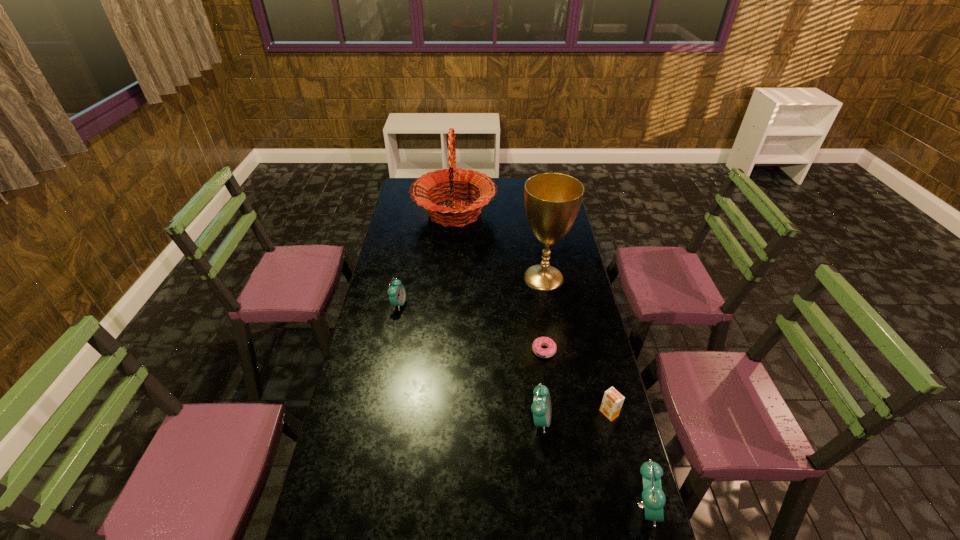
Image resolution: width=960 pixels, height=540 pixels. What are the coordinates of `orange juice` in the screenshot? It's located at (612, 402).

You are a GUI agent. You are given a task and a screenshot of the screen. Output one action in this format:
    pyautogui.click(x=<x>, y=<y>)
    Task: Click on the vacant space situated on the face of the shortest alarm clock
    This screenshot has width=960, height=540.
    Given the screenshot: What is the action you would take?
    pyautogui.click(x=491, y=305)

Image resolution: width=960 pixels, height=540 pixels. What are the coordinates of `free region located on the face of the second alarm clock from right to left` in the screenshot? It's located at [579, 420].

You are a GUI agent. You are given a task and a screenshot of the screen. Output one action in this format:
    pyautogui.click(x=<x>, y=<y>)
    Task: Click on the blank space located on the front of the basket
    
    Given the screenshot: What is the action you would take?
    pyautogui.click(x=451, y=253)

Locate an element on the screen. This screenshot has width=960, height=540. free spot located on the left of the doughnut is located at coordinates (462, 350).

At what (x,y) coordinates should I click in order to perform the action: click on free spot located 0.050m on the left of the second farthest object. Please return your answer as a coordinate pair (x, y). This screenshot has width=960, height=540. Looking at the image, I should click on (507, 278).

The image size is (960, 540). I want to click on vacant space located 0.050m on the left of the orange juice, so click(x=585, y=413).

Locate an element on the screen. This screenshot has width=960, height=540. object located in the far edge section of the desktop is located at coordinates (474, 181).

Where is `object positioned at the near edge`? The image size is (960, 540). object positioned at the near edge is located at coordinates (653, 497).

Locate an element on the screen. alarm clock at the left edge is located at coordinates (397, 294).